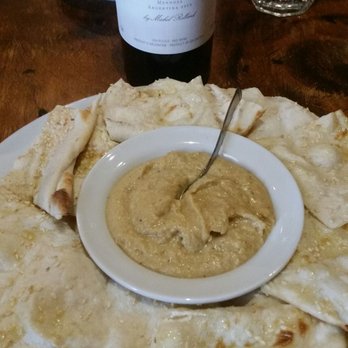
Identify the location of wood table. The width and height of the screenshot is (348, 348). (88, 72).